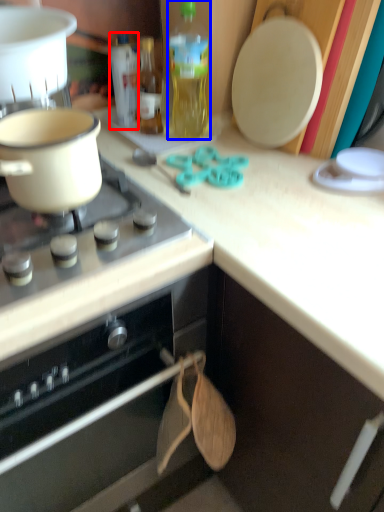
Question: Which object is closer to the camera taking this photo, bottle (highlighted by a red box) or bottle (highlighted by a blue box)?

Choices:
 (A) bottle
 (B) bottle

Answer: (B)